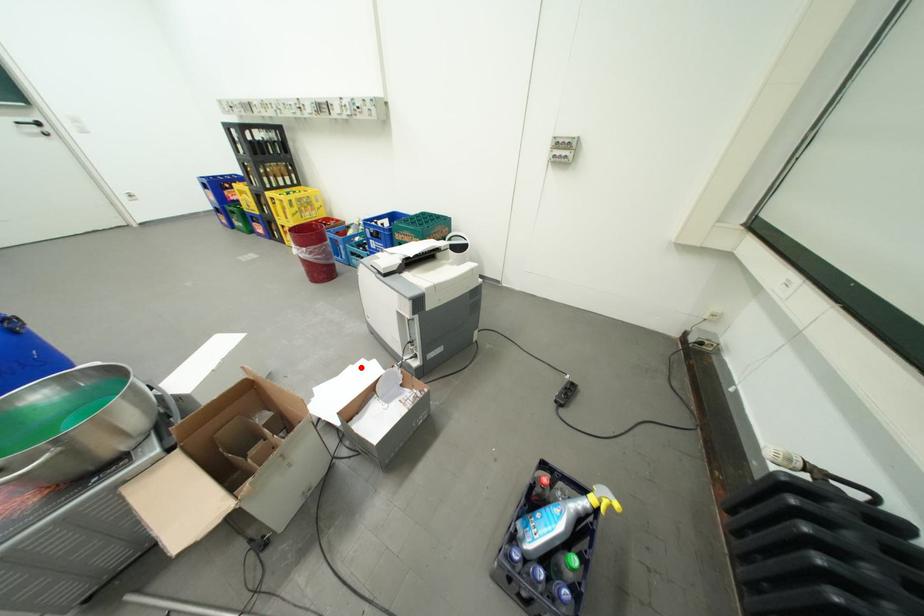
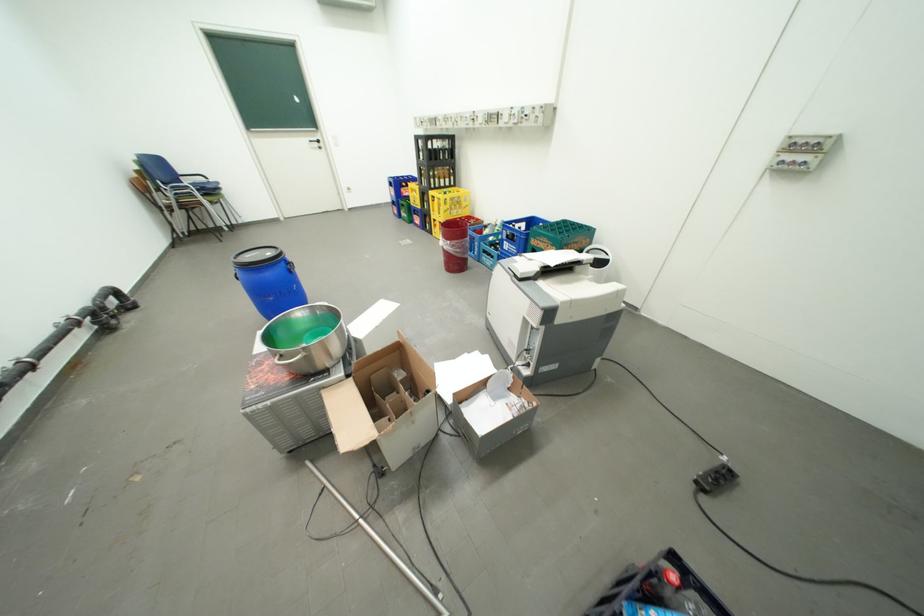
Where in the second image is the point corresponding to the highlighted location from the first image?

(477, 355)